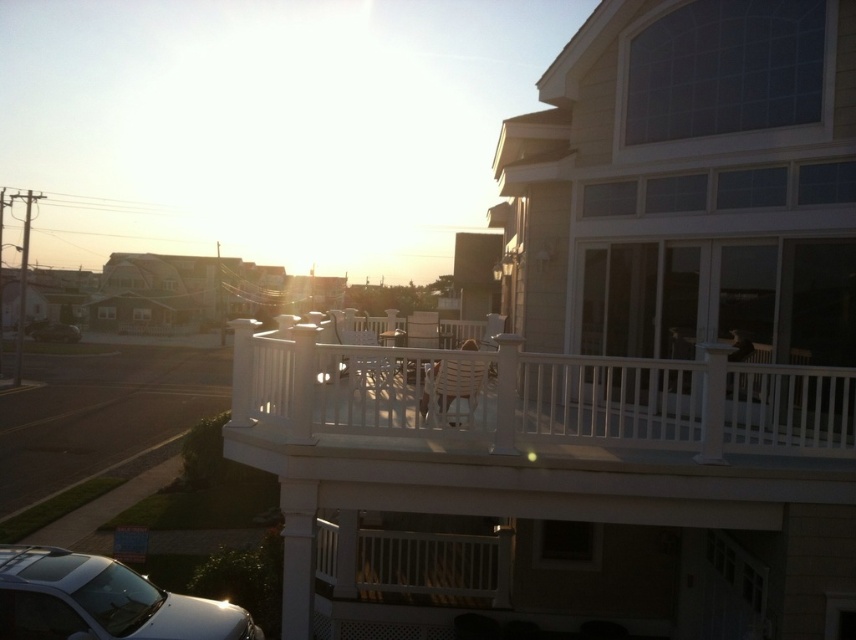
You are standing in the middle of the suburban scene and want to walk to the house. Which direction should you head relative to the metallic silver car at lower left to reach the white plastic porch at center?

The white plastic porch at center is to the right of the metallic silver car at lower left, so you should head to the right relative to the metallic silver car at lower left to reach the white plastic porch at center.

A child wants to walk from the white plastic porch at center to the red wooden swing set on the left. The path between them is 5.59 meters long. If the child walks at a speed of 1 meter per second, how many seconds will it take them to reach the swing set?

The path between the white plastic porch at center and the red wooden swing set on the left is 5.59 meters. Since the child walks at 1 meter per second, it will take them approximately 5.59 seconds to reach the swing set.

You are standing in the suburban scene and want to park your car under the white plastic porch at center to avoid the rain. Is the metallic silver car at lower left currently parked under the porch?

The white plastic porch at center is positioned over the metallic silver car at lower left, so yes, the metallic silver car at lower left is currently parked under the porch.